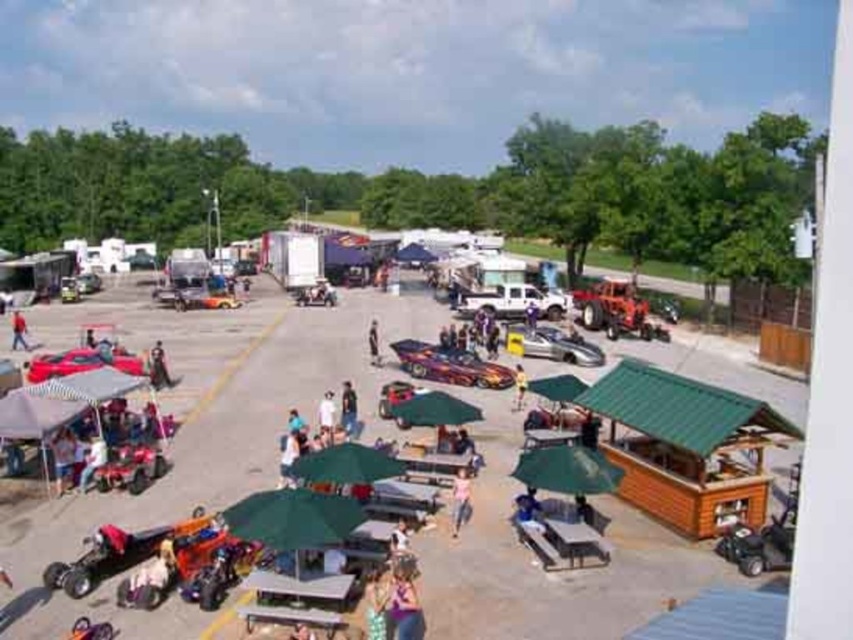
Based on the photo, does green corrugated metal canopy at center-right have a lesser height compared to green fabric umbrella at center?

Incorrect, green corrugated metal canopy at center-right's height does not fall short of green fabric umbrella at center's.

At what (x,y) coordinates should I click in order to perform the action: click on green corrugated metal canopy at center-right. Please return your answer as a coordinate pair (x, y). Image resolution: width=853 pixels, height=640 pixels. Looking at the image, I should click on (679, 406).

Identify the location of green corrugated metal canopy at center-right. The width and height of the screenshot is (853, 640). (679, 406).

Is shiny red car at lower left positioned in front of white fabric umbrella at center?

No, shiny red car at lower left is behind white fabric umbrella at center.

Can you confirm if shiny red car at lower left is wider than white fabric umbrella at center?

Indeed, shiny red car at lower left has a greater width compared to white fabric umbrella at center.

Is point (68, 355) closer to camera compared to point (331, 438)?

No, (68, 355) is further to viewer.

Where is `shiny red car at lower left`? shiny red car at lower left is located at coordinates (80, 362).

Which is in front, point (361, 461) or point (21, 328)?

Point (361, 461)

Which is behind, point (341, 449) or point (15, 337)?

Positioned behind is point (15, 337).

Between point (299, 454) and point (12, 314), which one is positioned in front?

Point (299, 454)

This screenshot has height=640, width=853. I want to click on green fabric umbrella at center, so [x=346, y=465].